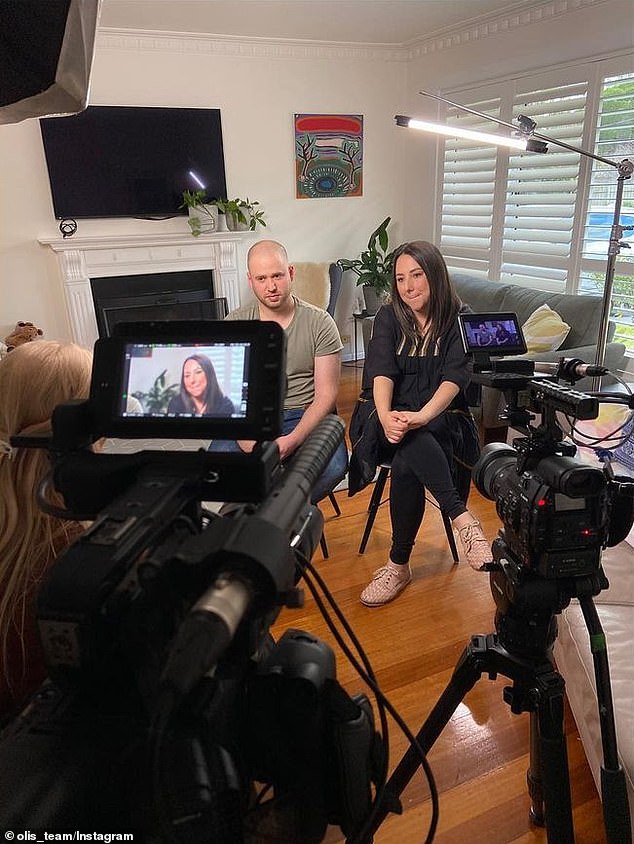
Locate an element on the screen. window is located at coordinates (440, 149).